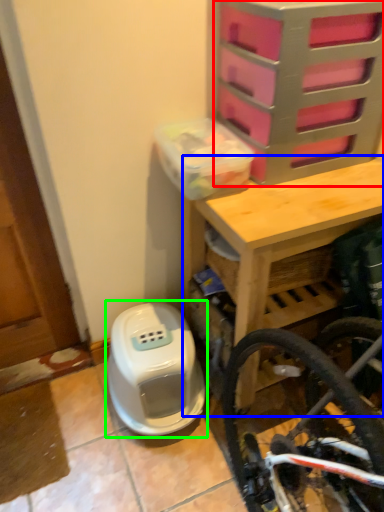
Question: Based on their relative distances, which object is nearer to drawer (highlighted by a red box)? Choose from table (highlighted by a blue box) and water heater (highlighted by a green box).

Choices:
 (A) table
 (B) water heater

Answer: (A)